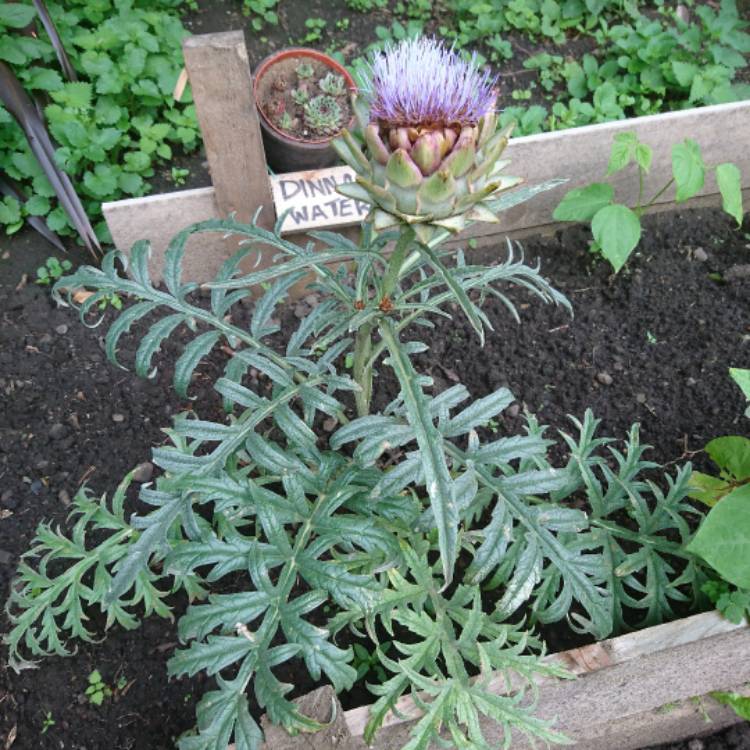
Where is `red pot`? red pot is located at coordinates (286, 55).